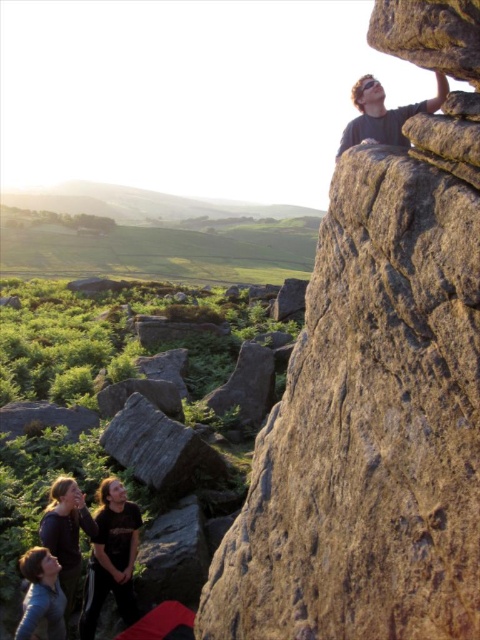
You are planning to take a photo of the rough textured rock at upper right and the dark brown leather jacket at lower left. Which object should you focus on first if you want to capture both in a single frame without moving the camera?

You should focus on the rough textured rock at upper right first because it is positioned to the right of the dark brown leather jacket at lower left, so adjusting the camera frame to include both would require ensuring the rightmost object is within the view first.

You are a hiker trying to reach the top of the rock formation. You see two climbers, the dark blue shirt at lower left and the matte black shirt at upper right. Which climber is closer to the top of the rock formation?

The matte black shirt at upper right is closer to the top of the rock formation since they are positioned above the dark blue shirt at lower left.

You are a hiker trying to reach the top of the rough textured rock at upper right. You see the blue denim jacket at lower left nearby. Which object is higher in elevation?

The rough textured rock at upper right is higher in elevation than the blue denim jacket at lower left because it is positioned above it.